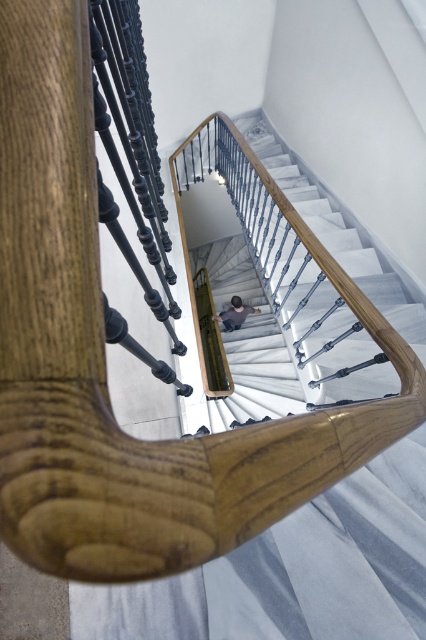
You are standing on the spiral staircase and looking down at the white marble stairs at center and the dark gray shirt at center. Which object is higher up in the image?

The white marble stairs at center is taller than the dark gray shirt at center, so the white marble stairs at center is higher up in the image.

You are standing at the bottom of the spiral staircase and notice a dark gray shirt at center. To avoid stepping on it, should you step to the left or right of the white marble stairs at center?

The white marble stairs at center might be wider than the dark gray shirt at center, so stepping either to the left or right of the white marble stairs at center should avoid the shirt.

You are standing at the top of the spiral staircase and looking down. You see the white marble stairs at center and the dark gray shirt at center. Which object is closer to you?

The dark gray shirt at center is closer to you because it is positioned above the white marble stairs at center.